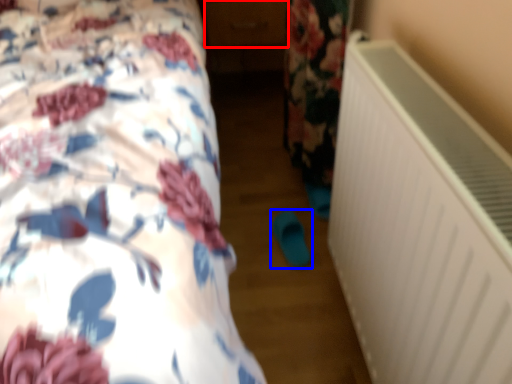
Question: Which of the following is the closest to the observer, drawer (highlighted by a red box) or footwear (highlighted by a blue box)?

Choices:
 (A) drawer
 (B) footwear

Answer: (B)